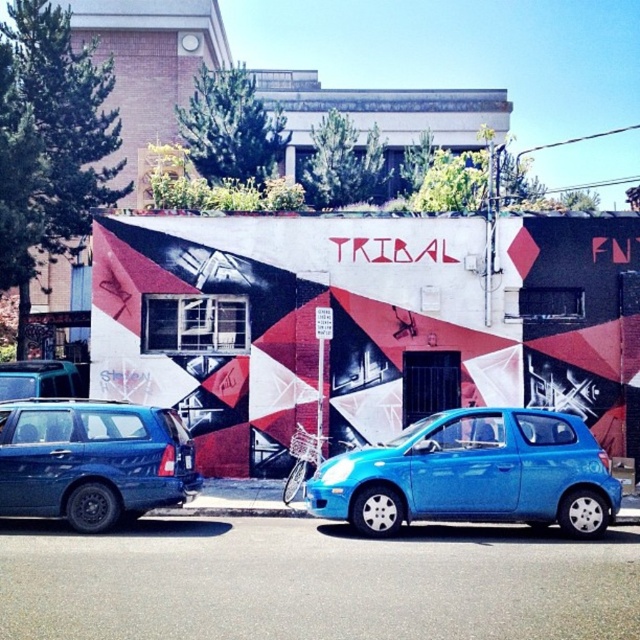
Does metallic blue hatchback at center appear on the right side of metallic blue suv at left?

Correct, you'll find metallic blue hatchback at center to the right of metallic blue suv at left.

Who is more distant from viewer, (584, 525) or (160, 440)?

The point (160, 440) is behind.

Who is more forward, (545, 524) or (20, 465)?

Point (20, 465) is more forward.

This screenshot has height=640, width=640. I want to click on metallic blue hatchback at center, so click(x=474, y=474).